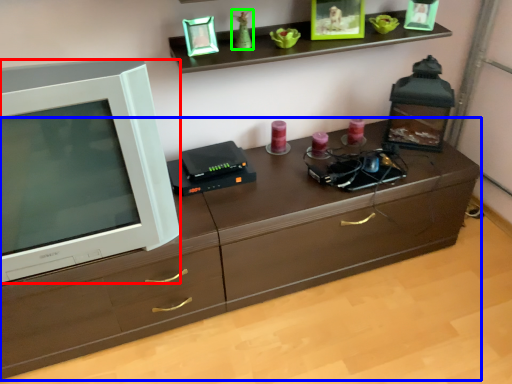
Question: Considering the real-world distances, which object is farthest from television (highlighted by a red box)? chest of drawers (highlighted by a blue box) or toy (highlighted by a green box)?

Choices:
 (A) chest of drawers
 (B) toy

Answer: (B)